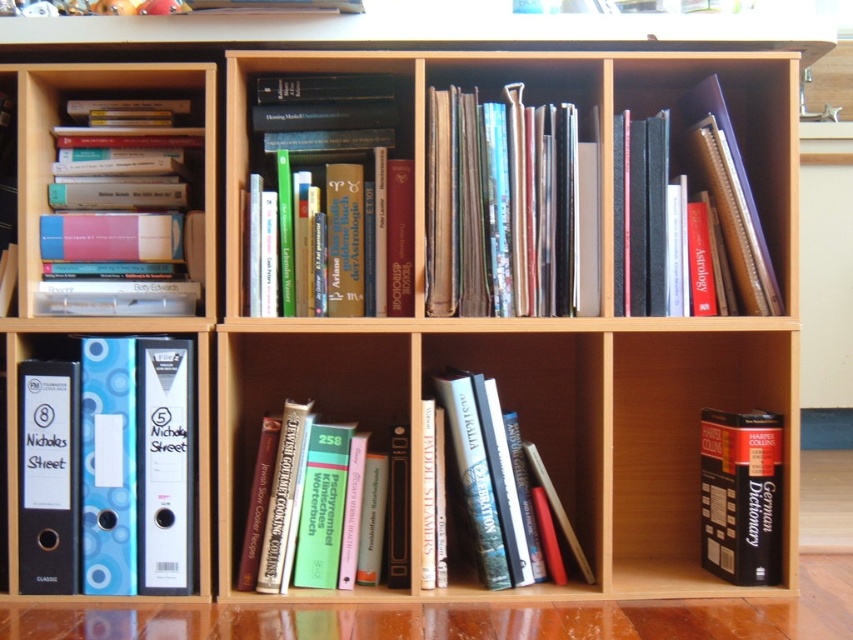
You are organizing the bookshelf and need to place a new item between the shiny metallic books at center and the matte hardcover books at upper left. Which object should you move to make space?

You should move the shiny metallic books at center because it is in front of the matte hardcover books at upper left, so moving it would create space between them.

You are organizing the bookshelf and need to access the hardcover book at upper right. Is the black hardcover dictionary at lower right blocking your view of it?

The black hardcover dictionary at lower right is in front of the hardcover book at upper right, so it is blocking the view of the hardcover book at upper right.

You are organizing a library and need to place the blue glossy folder at left and the shiny metallic books at center into a storage box. The box can only hold items that are narrower than 10 cm. Do you think both items will fit?

The blue glossy folder at left has a lesser width compared to shiny metallic books at center. Since the folder is narrower, it might fit, but the metallic books might exceed the 10 cm limit. Check their exact widths to confirm.